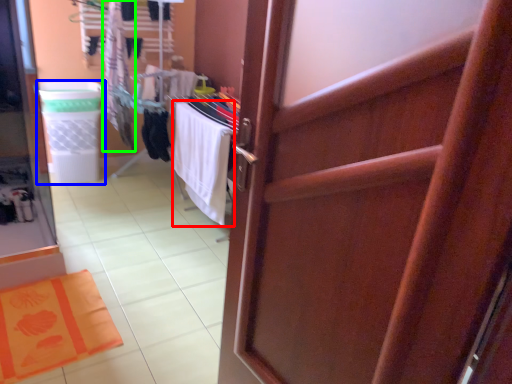
Question: Considering the real-world distances, which object is closest to beach towel (highlighted by a red box)? laundry basket (highlighted by a blue box) or clothing (highlighted by a green box).

Choices:
 (A) laundry basket
 (B) clothing

Answer: (B)